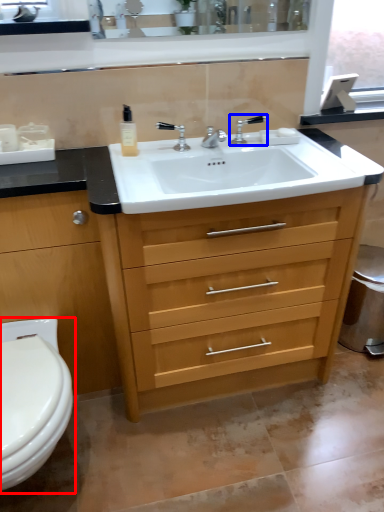
Question: Which point is further to the camera, toilet (highlighted by a red box) or tap (highlighted by a blue box)?

Choices:
 (A) toilet
 (B) tap

Answer: (B)